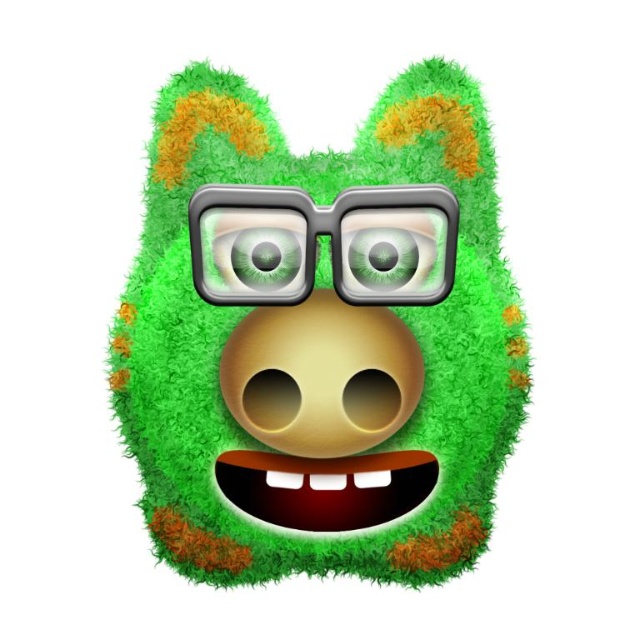
From the picture: Where is the fuzzy green creature at center positioned in the image?

The fuzzy green creature at center is positioned at point coordinates of 0.539 along the x axis and 0.497 along the y axis.

The character has two eyes, a green matte eye at center and a green glossy eye at center. Which one is taller?

The green matte eye at center is much taller than the green glossy eye at center.